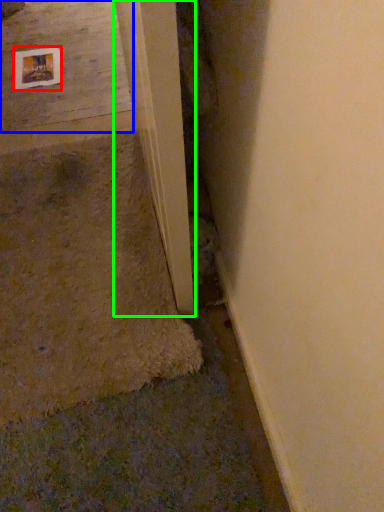
Question: Which object is the closest to the picture frame (highlighted by a red box)? Choose among these: concrete (highlighted by a blue box) or beam (highlighted by a green box).

Choices:
 (A) concrete
 (B) beam

Answer: (A)